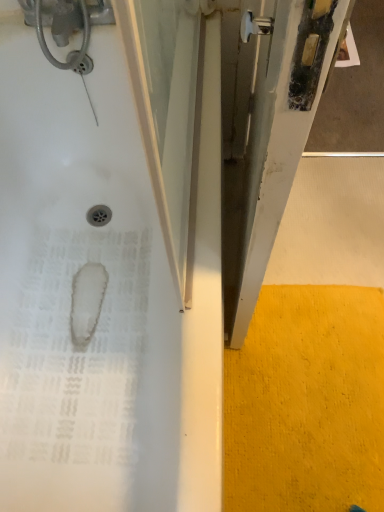
What is the approximate width of white glossy bathtub at left?

27.81 inches.

What do you see at coordinates (104, 298) in the screenshot? The image size is (384, 512). I see `white glossy bathtub at left` at bounding box center [104, 298].

Where is `white glossy bathtub at left`? The width and height of the screenshot is (384, 512). white glossy bathtub at left is located at coordinates (104, 298).

What do you see at coordinates (307, 402) in the screenshot? Image resolution: width=384 pixels, height=512 pixels. I see `yellow textured carpet at lower right` at bounding box center [307, 402].

Identify the location of yellow textured carpet at lower right. (307, 402).

The height and width of the screenshot is (512, 384). I want to click on white glossy bathtub at left, so pos(104,298).

Considering the relative positions of yellow textured carpet at lower right and white glossy bathtub at left in the image provided, is yellow textured carpet at lower right to the right of white glossy bathtub at left from the viewer's perspective?

Correct, you'll find yellow textured carpet at lower right to the right of white glossy bathtub at left.

Does yellow textured carpet at lower right lie in front of white glossy bathtub at left?

No, it is behind white glossy bathtub at left.

Considering the positions of point (382, 490) and point (136, 385), is point (382, 490) closer or farther from the camera than point (136, 385)?

Point (382, 490) is positioned farther from the camera compared to point (136, 385).

From the picture: From the image's perspective, is yellow textured carpet at lower right located above white glossy bathtub at left?

No, from the image's perspective, yellow textured carpet at lower right is not over white glossy bathtub at left.

From a real-world perspective, is yellow textured carpet at lower right on white glossy bathtub at left?

No, from a real-world perspective, yellow textured carpet at lower right is not on top of white glossy bathtub at left.

Considering the sizes of objects yellow textured carpet at lower right and white glossy bathtub at left in the image provided, who is wider, yellow textured carpet at lower right or white glossy bathtub at left?

With larger width is white glossy bathtub at left.

Can you confirm if yellow textured carpet at lower right is taller than white glossy bathtub at left?

In fact, yellow textured carpet at lower right may be shorter than white glossy bathtub at left.

Is yellow textured carpet at lower right bigger or smaller than white glossy bathtub at left?

In the image, yellow textured carpet at lower right appears to be smaller than white glossy bathtub at left.

Is white glossy bathtub at left surrounded by yellow textured carpet at lower right?

No, white glossy bathtub at left is located outside of yellow textured carpet at lower right.

Is yellow textured carpet at lower right positioned far away from white glossy bathtub at left?

No, there isn't a large distance between yellow textured carpet at lower right and white glossy bathtub at left.

Is yellow textured carpet at lower right aimed at white glossy bathtub at left?

No.

At what (x,y) coordinates should I click in order to perform the action: click on bathtub that appears above the yellow textured carpet at lower right (from the image's perspective). Please return your answer as a coordinate pair (x, y). Looking at the image, I should click on (104, 298).

Considering the relative positions of white glossy bathtub at left and yellow textured carpet at lower right in the image provided, is white glossy bathtub at left to the left or to the right of yellow textured carpet at lower right?

white glossy bathtub at left is positioned on yellow textured carpet at lower right's left side.

Is white glossy bathtub at left further to camera compared to yellow textured carpet at lower right?

No, white glossy bathtub at left is closer to the viewer.

Which is less distant, (x=168, y=426) or (x=251, y=490)?

Point (x=168, y=426) is closer to the camera than point (x=251, y=490).

From the image's perspective, which is below, white glossy bathtub at left or yellow textured carpet at lower right?

yellow textured carpet at lower right appears lower in the image.

From a real-world perspective, which is physically below, white glossy bathtub at left or yellow textured carpet at lower right?

yellow textured carpet at lower right is physically lower.

Which of these two, white glossy bathtub at left or yellow textured carpet at lower right, is wider?

Wider between the two is white glossy bathtub at left.

Does white glossy bathtub at left have a lesser height compared to yellow textured carpet at lower right?

No.

Does white glossy bathtub at left have a smaller size compared to yellow textured carpet at lower right?

No, white glossy bathtub at left is not smaller than yellow textured carpet at lower right.

Is yellow textured carpet at lower right located within white glossy bathtub at left?

No, white glossy bathtub at left does not contain yellow textured carpet at lower right.

Is white glossy bathtub at left next to yellow textured carpet at lower right and touching it?

No, white glossy bathtub at left is not making contact with yellow textured carpet at lower right.

Is white glossy bathtub at left oriented away from yellow textured carpet at lower right?

That's not correct — white glossy bathtub at left is not looking away from yellow textured carpet at lower right.

Identify the location of concrete below the white glossy bathtub at left (from the image's perspective). The height and width of the screenshot is (512, 384). (307, 402).

I want to click on concrete that is under the white glossy bathtub at left (from a real-world perspective), so click(x=307, y=402).

This screenshot has height=512, width=384. I want to click on concrete that is below the white glossy bathtub at left (from the image's perspective), so click(307, 402).